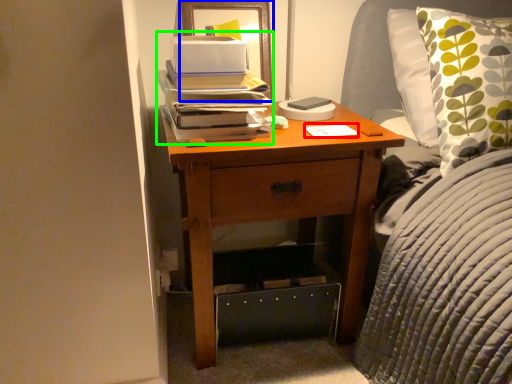
Question: Which is farther away from notepad (highlighted by a red box)? picture frame (highlighted by a blue box) or book (highlighted by a green box)?

Choices:
 (A) picture frame
 (B) book

Answer: (A)